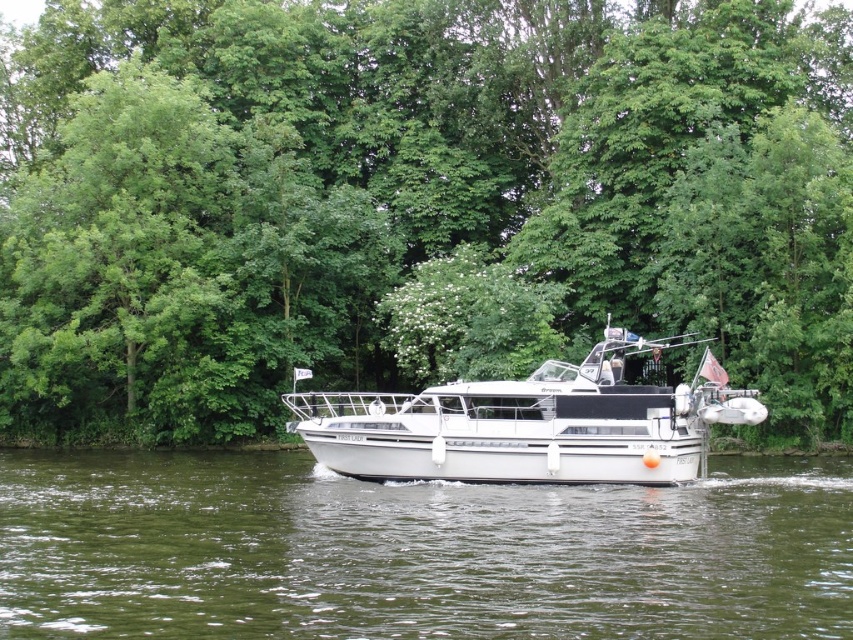
Question: Can you confirm if green leafy trees at center is positioned to the left of white glossy boat at center?

Choices:
 (A) no
 (B) yes

Answer: (B)

Question: In this image, where is green water at center located relative to white glossy boat at center?

Choices:
 (A) above
 (B) below

Answer: (B)

Question: Is the position of green leafy trees at center more distant than that of white glossy boat at center?

Choices:
 (A) no
 (B) yes

Answer: (B)

Question: Which object appears closest to the camera in this image?

Choices:
 (A) green leafy trees at center
 (B) green water at center
 (C) white glossy boat at center

Answer: (B)

Question: Which object is the closest to the white glossy boat at center?

Choices:
 (A) green water at center
 (B) green leafy trees at center

Answer: (A)

Question: Estimate the real-world distances between objects in this image. Which object is farther from the green water at center?

Choices:
 (A) green leafy trees at center
 (B) white glossy boat at center

Answer: (A)